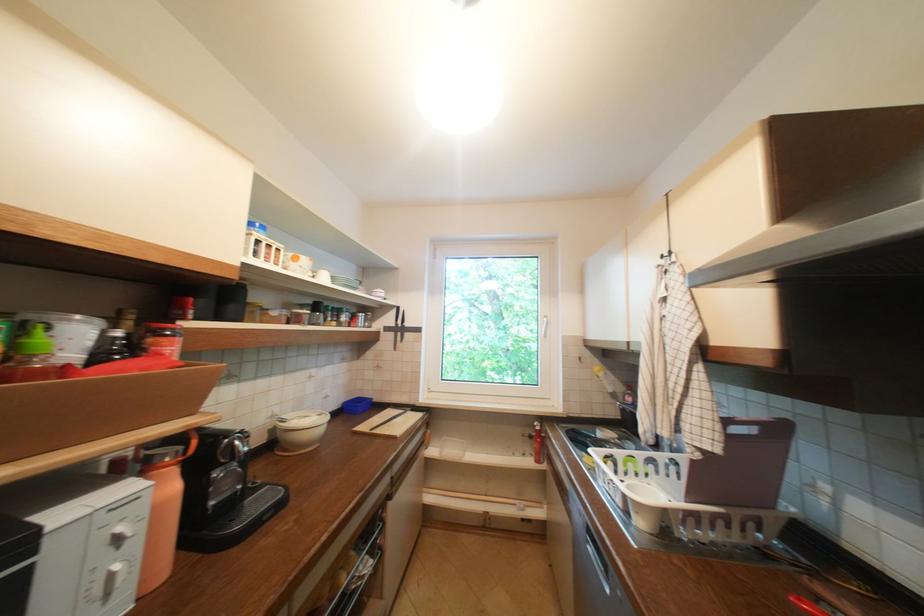
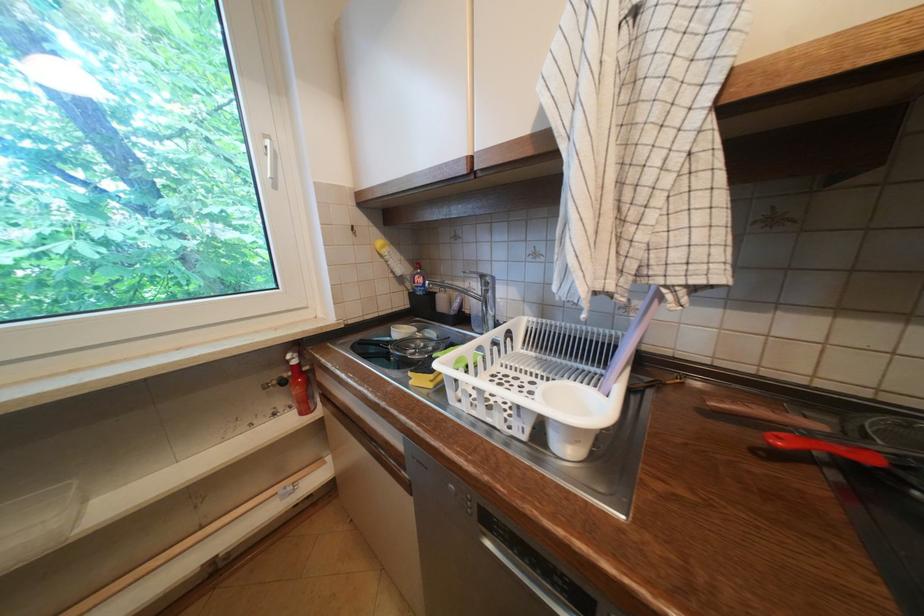
Locate, in the second image, the point that corresponds to point (646, 514) in the first image.

(586, 443)